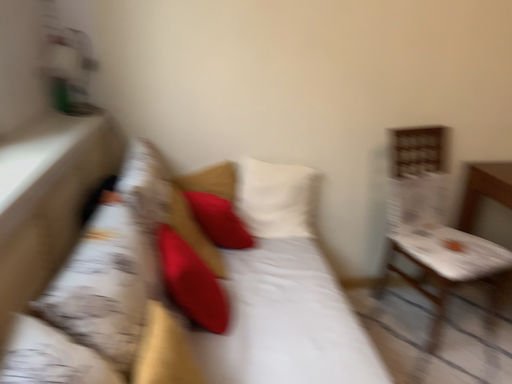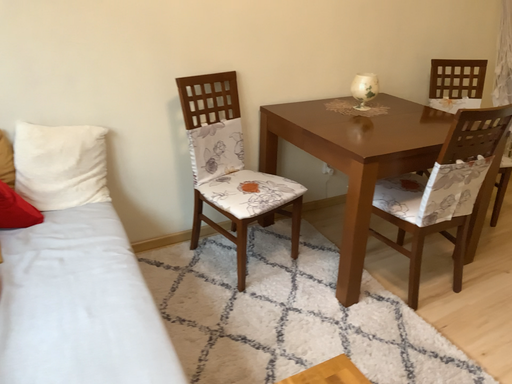
Question: How did the camera likely rotate when shooting the video?

Choices:
 (A) rotated left
 (B) rotated right

Answer: (B)